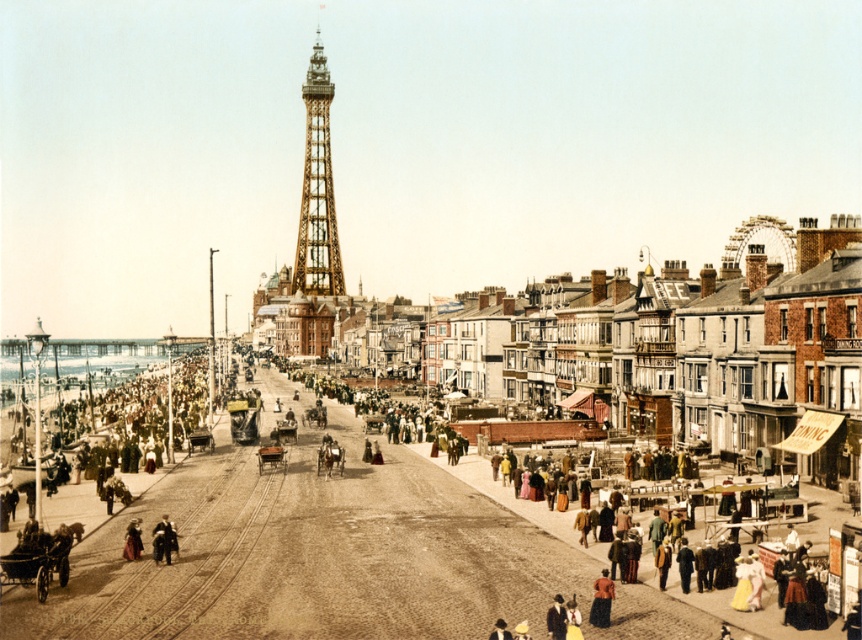
Question: Estimate the real-world distances between objects in this image. Which object is closer to the matte red dress at lower left?

Choices:
 (A) golden metallic tower at center
 (B) brown fabric dress at lower right

Answer: (B)

Question: Can you confirm if golden metallic tower at center is smaller than brown fabric dress at lower right?

Choices:
 (A) yes
 (B) no

Answer: (B)

Question: Can you confirm if golden metallic tower at center is wider than matte red dress at lower left?

Choices:
 (A) no
 (B) yes

Answer: (B)

Question: Which of the following is the closest to the observer?

Choices:
 (A) golden metallic tower at center
 (B) brown fabric dress at lower right

Answer: (B)

Question: Is golden metallic tower at center wider than matte red dress at lower left?

Choices:
 (A) yes
 (B) no

Answer: (A)

Question: Estimate the real-world distances between objects in this image. Which object is closer to the brown fabric dress at lower right?

Choices:
 (A) matte red dress at lower left
 (B) golden metallic tower at center

Answer: (A)